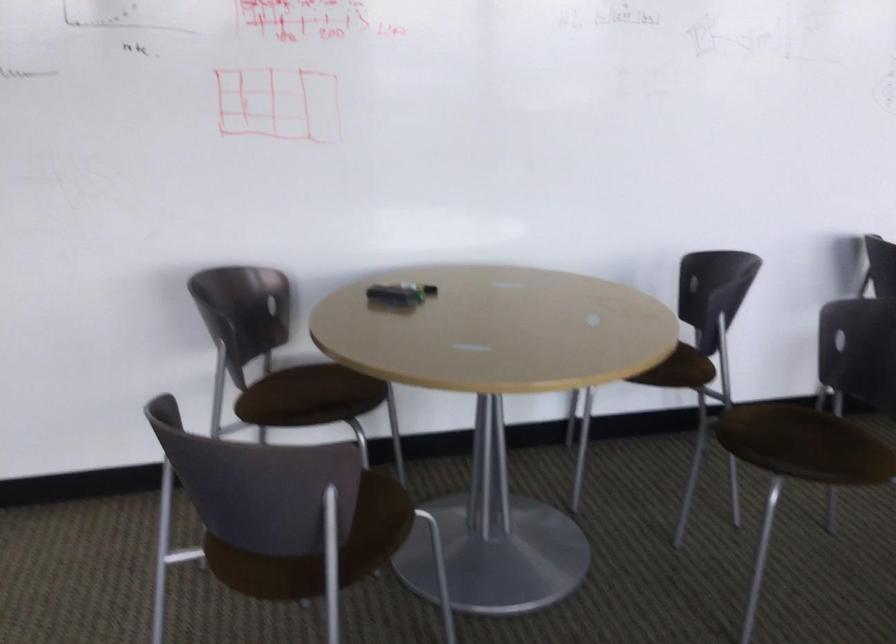
The location [433,290] corresponds to which object?

This point indicates the black marker cap.